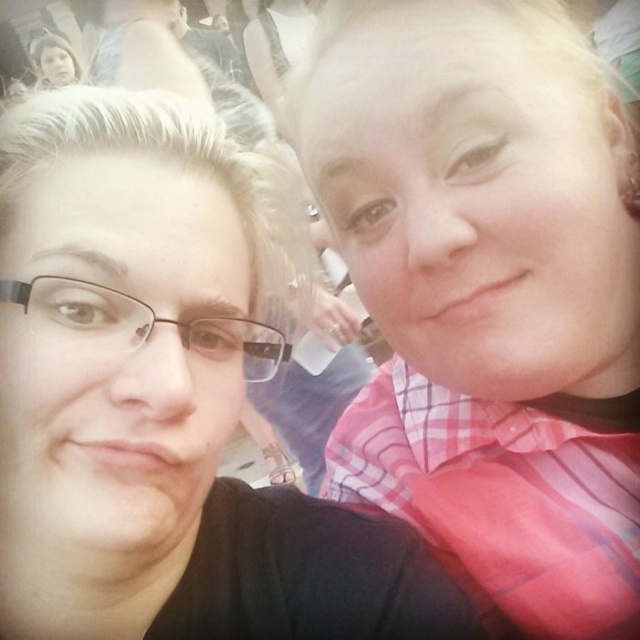
You are taking a photo of the scene and want to focus on the pink checkered shirt at center. What are the coordinates where you should aim your camera?

The coordinates to focus on the pink checkered shirt at center are at point (x=486, y=292).

You are taking a photo with your phone, which has a minimum focus distance of 12 inches. You want to capture the pink checkered shirt at upper right clearly. Can you focus on it?

The pink checkered shirt at upper right is 14.86 inches away from the camera, which is beyond the phone camera minimum focus distance of 12 inches. Therefore, the phone can focus on the pink checkered shirt at upper right.

From the picture: You are taking a photo of the two people in the foreground. You want to focus on the person on the left. Which of the two points, point (412, 422) or point (92, 403), should you focus on to ensure the person on the left is in sharp focus?

To ensure the person on the left is in sharp focus, you should focus on point (412, 422) because it is closer to the camera compared to point (92, 403).